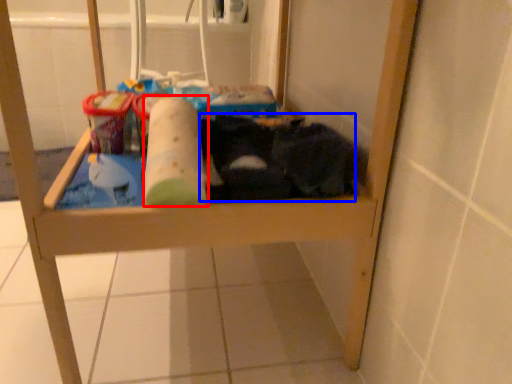
Question: Which object is further to the camera taking this photo, toilet paper (highlighted by a red box) or laundry (highlighted by a blue box)?

Choices:
 (A) toilet paper
 (B) laundry

Answer: (B)